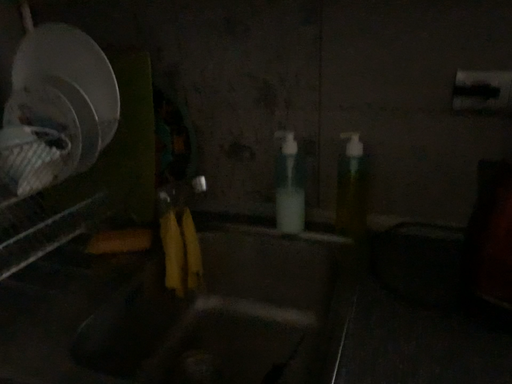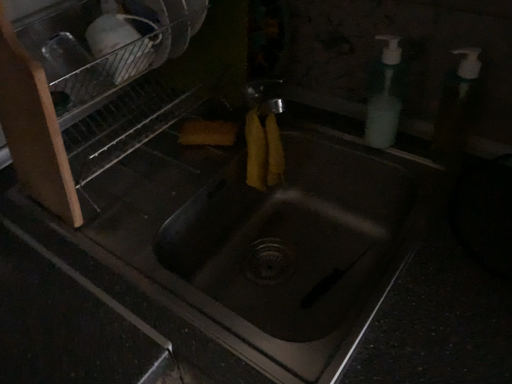
Question: Which way did the camera rotate in the video?

Choices:
 (A) rotated left
 (B) rotated right

Answer: (A)